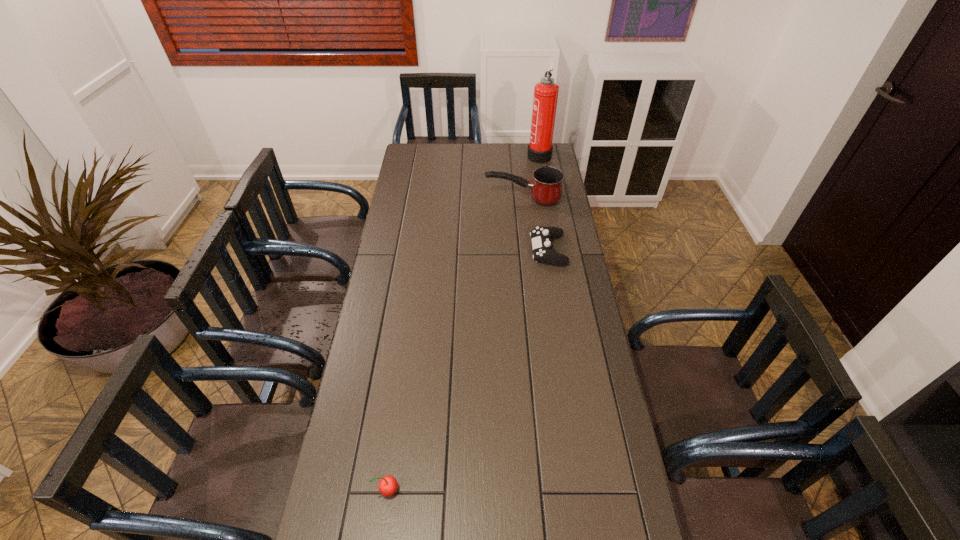
This screenshot has height=540, width=960. I want to click on the tallest object, so click(x=540, y=148).

This screenshot has width=960, height=540. I want to click on the farthest object, so click(x=540, y=148).

You are a GUI agent. You are given a task and a screenshot of the screen. Output one action in this format:
    pyautogui.click(x=<x>, y=<y>)
    Task: Click on the third nearest object
    The width and height of the screenshot is (960, 540).
    Given the screenshot: What is the action you would take?
    pyautogui.click(x=546, y=188)

Find the location of `saucepan`. saucepan is located at coordinates (546, 188).

Identify the location of the leftmost object. (387, 486).

This screenshot has height=540, width=960. What are the coordinates of `cherry` in the screenshot? It's located at (387, 486).

I want to click on the shortest object, so click(541, 237).

Find the location of a particular element. Image resolution: width=960 pixels, height=540 pixels. the second nearest object is located at coordinates (541, 237).

Identify the location of vacant space situated on the front-facing side of the fire extinguisher. (449, 154).

Where is `vacant space located on the front-facing side of the fire extinguisher`? The width and height of the screenshot is (960, 540). vacant space located on the front-facing side of the fire extinguisher is located at coordinates (484, 154).